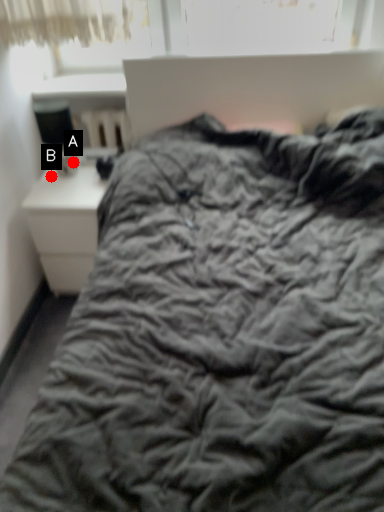
Question: Two points are circled on the image, labeled by A and B beside each circle. Among these points, which one is farthest from the camera?

Choices:
 (A) A is further
 (B) B is further

Answer: (A)